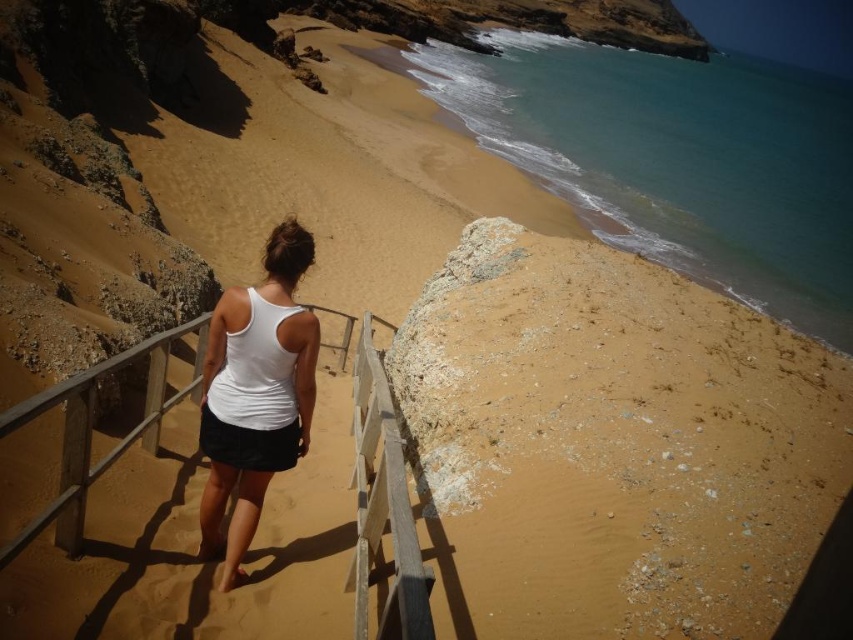
You are standing at the top of the wooden staircase and want to place a small bag on the ground near the brown sandy beach at center and the white matte tank top at center. Which object should you place it closer to if you want it to be more visible against the background?

The white matte tank top at center is wider than the brown sandy beach at center, so placing the bag near the white matte tank top at center would make it more visible against the background.

You are standing on the wooden staircase leading to the brown sandy beach at center and wearing the white matte tank top at center. If you want to place a small object on the ground, which one would you need to bend down less to reach?

The brown sandy beach at center has a lesser height compared to the white matte tank top at center, so you would need to bend down less to place the object on the white matte tank top at center since it is higher.